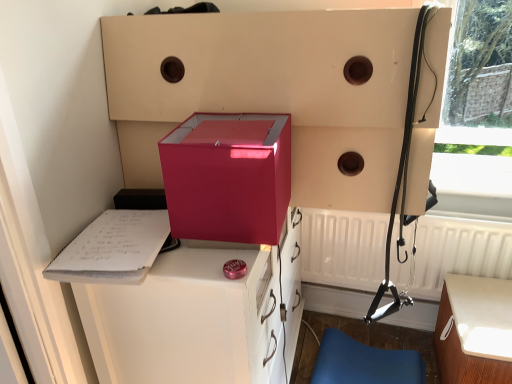
The image size is (512, 384). I want to click on matte pink box at center, so click(x=228, y=177).

The image size is (512, 384). What do you see at coordinates (403, 173) in the screenshot?
I see `matte black harness at right` at bounding box center [403, 173].

Describe the element at coordinates (472, 329) in the screenshot. Image resolution: width=512 pixels, height=384 pixels. I see `white wood table at lower right` at that location.

The height and width of the screenshot is (384, 512). What do you see at coordinates (186, 319) in the screenshot?
I see `glossy plastic vanity at center` at bounding box center [186, 319].

The height and width of the screenshot is (384, 512). I want to click on matte pink box at center, so click(228, 177).

Identify the location of clipboard that appears below the matte pink box at center (from a real-world perspective). (x=113, y=248).

Is white paper clipboard at left far from matte pink box at center?

They are positioned close to each other.

Consider the image. Which of these two, white paper clipboard at left or matte pink box at center, stands taller?

With more height is matte pink box at center.

The width and height of the screenshot is (512, 384). I want to click on furniture that is under the glossy plastic vanity at center (from a real-world perspective), so click(x=364, y=363).

Is point (385, 380) farther from viewer compared to point (112, 373)?

Yes, point (385, 380) is farther from viewer.

Who is taller, blue leather chair at lower right or glossy plastic vanity at center?

Standing taller between the two is glossy plastic vanity at center.

From the picture: Are blue leather chair at lower right and glossy plastic vanity at center located far from each other?

No, there isn't a large distance between blue leather chair at lower right and glossy plastic vanity at center.

Is matte black harness at right looking in the opposite direction of white matte radiator at lower right?

No.

Based on the photo, from the image's perspective, is matte black harness at right above white matte radiator at lower right?

Yes, from the image's perspective, matte black harness at right is on top of white matte radiator at lower right.

Is point (391, 226) closer or farther from the camera than point (511, 242)?

Point (391, 226) is closer to the camera than point (511, 242).

Is matte black harness at right wider or thinner than white matte radiator at lower right?

In the image, matte black harness at right appears to be more narrow than white matte radiator at lower right.

Can we say glossy plastic vanity at center lies outside white wood table at lower right?

Yes, glossy plastic vanity at center is not within white wood table at lower right.

Find the location of a particular element. This screenshot has width=512, height=384. vanity above the white wood table at lower right (from the image's perspective) is located at coordinates (186, 319).

From a real-world perspective, is glossy plastic vanity at center positioned over white wood table at lower right based on gravity?

Yes, from a real-world perspective, glossy plastic vanity at center is above white wood table at lower right.

Based on their positions, is glossy plastic vanity at center located to the left or right of white wood table at lower right?

In the image, glossy plastic vanity at center appears on the left side of white wood table at lower right.

Between glossy plastic vanity at center and white paper clipboard at left, which one is positioned behind?

Positioned behind is white paper clipboard at left.

From the image's perspective, is glossy plastic vanity at center above or below white paper clipboard at left?

Clearly, from the image's perspective, glossy plastic vanity at center is below white paper clipboard at left.

From the picture: Between glossy plastic vanity at center and white paper clipboard at left, which one has larger size?

glossy plastic vanity at center is bigger.

Would you say glossy plastic vanity at center is to the left or to the right of white paper clipboard at left in the picture?

Based on their positions, glossy plastic vanity at center is located to the right of white paper clipboard at left.

Find the location of a particular element. This screenshot has height=384, width=512. table on the right of blue leather chair at lower right is located at coordinates (472, 329).

Which of these two, blue leather chair at lower right or white wood table at lower right, is wider?

With larger width is white wood table at lower right.

Do you think blue leather chair at lower right is within white wood table at lower right, or outside of it?

blue leather chair at lower right lies outside white wood table at lower right.

Does blue leather chair at lower right have a greater height compared to white wood table at lower right?

Incorrect, the height of blue leather chair at lower right is not larger of that of white wood table at lower right.

Between matte pink box at center and white paper clipboard at left, which one is positioned behind?

white paper clipboard at left.

Can we say matte pink box at center lies outside white paper clipboard at left?

Absolutely, matte pink box at center is external to white paper clipboard at left.

From the picture: Considering the sizes of objects matte pink box at center and white paper clipboard at left in the image provided, who is thinner, matte pink box at center or white paper clipboard at left?

Thinner between the two is matte pink box at center.

Where is `box in front of the white paper clipboard at left`? box in front of the white paper clipboard at left is located at coordinates (228, 177).

At what (x,y) coordinates should I click in order to perform the action: click on furniture below the glossy plastic vanity at center (from a real-world perspective). Please return your answer as a coordinate pair (x, y). The height and width of the screenshot is (384, 512). Looking at the image, I should click on (364, 363).

Estimate the real-world distances between objects in this image. Which object is further from blue leather chair at lower right, white wood table at lower right or glossy plastic vanity at center?

The object further to blue leather chair at lower right is glossy plastic vanity at center.

From the image, which object appears to be nearer to matte black harness at right, glossy plastic vanity at center or blue leather chair at lower right?

The object closer to matte black harness at right is blue leather chair at lower right.

Based on their spatial positions, is matte black harness at right or glossy plastic vanity at center further from white matte radiator at lower right?

Among the two, glossy plastic vanity at center is located further to white matte radiator at lower right.

Considering their positions, is white matte radiator at lower right positioned further to white paper clipboard at left than blue leather chair at lower right?

blue leather chair at lower right.

Looking at this image, looking at the image, which one is located further to blue leather chair at lower right, white matte radiator at lower right or matte pink box at center?

The object further to blue leather chair at lower right is matte pink box at center.

Considering their positions, is white matte radiator at lower right positioned further to blue leather chair at lower right than white wood table at lower right?

white matte radiator at lower right is positioned further to the anchor blue leather chair at lower right.

Consider the image. Considering their positions, is matte pink box at center positioned further to white wood table at lower right than matte black harness at right?

matte pink box at center is further to white wood table at lower right.

From the picture: From the image, which object appears to be nearer to white paper clipboard at left, glossy plastic vanity at center or white matte radiator at lower right?

The object closer to white paper clipboard at left is glossy plastic vanity at center.

Locate an element on the screen. box between white paper clipboard at left and white matte radiator at lower right is located at coordinates tap(228, 177).

I want to click on vanity between matte pink box at center and blue leather chair at lower right in the vertical direction, so click(186, 319).

Where is `twin between white paper clipboard at left and white matte radiator at lower right`? The image size is (512, 384). twin between white paper clipboard at left and white matte radiator at lower right is located at coordinates (403, 173).

Where is `furniture between white paper clipboard at left and white matte radiator at lower right from left to right`? furniture between white paper clipboard at left and white matte radiator at lower right from left to right is located at coordinates (364, 363).